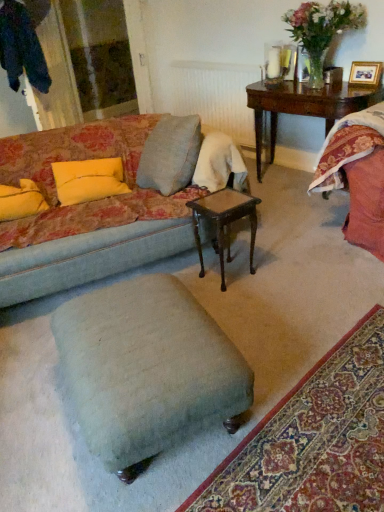
Question: In terms of size, does white textured radiator at upper center appear bigger or smaller than wooden picture frame at upper right?

Choices:
 (A) small
 (B) big

Answer: (B)

Question: Looking at their shapes, would you say white textured radiator at upper center is wider or thinner than wooden picture frame at upper right?

Choices:
 (A) thin
 (B) wide

Answer: (B)

Question: Which of these objects is positioned closest to the wooden stained table at center?

Choices:
 (A) dark wood side table at upper right
 (B) velvet teal ottoman at lower center
 (C) white textured radiator at upper center
 (D) velvet floral couch at center
 (E) yellow fabric pillow at left, arranged as the 2th pillow when viewed from the left

Answer: (D)

Question: Which of these objects is positioned closest to the velvet teal ottoman at lower center?

Choices:
 (A) yellow fabric pillow at left, which is the first pillow in left-to-right order
 (B) wooden picture frame at upper right
 (C) yellow fabric pillow at left, arranged as the 2th pillow when viewed from the left
 (D) light blue fabric stool at center
 (E) dark wood side table at upper right

Answer: (D)